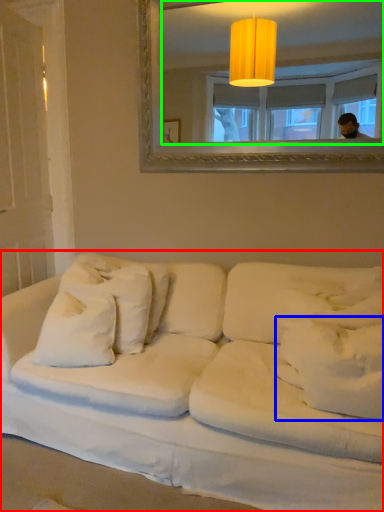
Question: Based on their relative distances, which object is nearer to studio couch (highlighted by a red box)? Choose from pillow (highlighted by a blue box) and mirror (highlighted by a green box).

Choices:
 (A) pillow
 (B) mirror

Answer: (A)